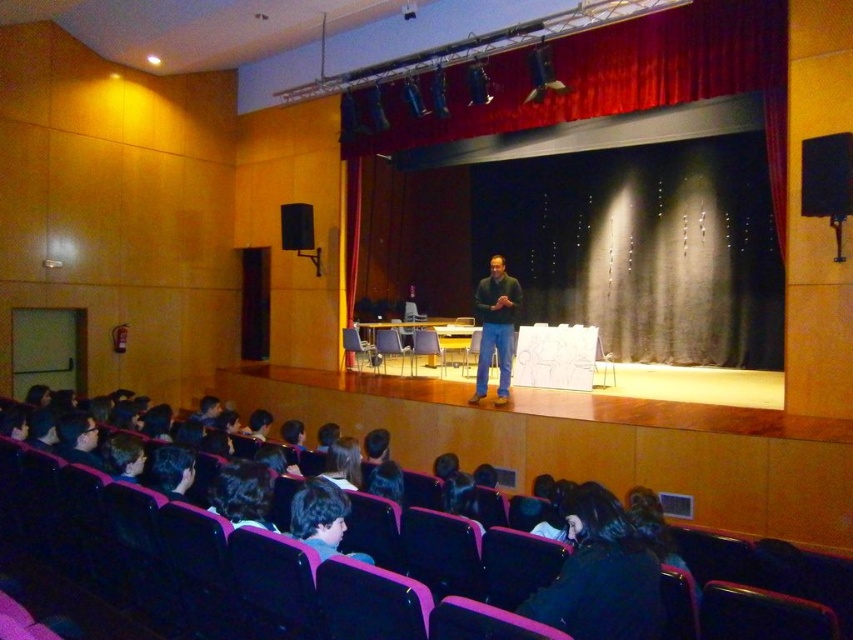
Is red velvet curtain at upper center thinner than black fabric at lower center?

Incorrect, red velvet curtain at upper center's width is not less than black fabric at lower center's.

Is red velvet curtain at upper center to the right of black fabric at lower center from the viewer's perspective?

Yes, red velvet curtain at upper center is to the right of black fabric at lower center.

Does point (465, 97) come in front of point (631, 556)?

That is False.

You are a GUI agent. You are given a task and a screenshot of the screen. Output one action in this format:
    pyautogui.click(x=<x>, y=<y>)
    Task: Click on the red velvet curtain at upper center
    This screenshot has height=640, width=853.
    Given the screenshot: What is the action you would take?
    pyautogui.click(x=556, y=122)

Who is taller, dark green sweater at center or black matte speaker at upper left?

dark green sweater at center

Does dark green sweater at center have a larger size compared to black matte speaker at upper left?

Indeed, dark green sweater at center has a larger size compared to black matte speaker at upper left.

Locate an element on the screen. The image size is (853, 640). dark green sweater at center is located at coordinates (495, 326).

Image resolution: width=853 pixels, height=640 pixels. Find the location of `dark green sweater at center`. dark green sweater at center is located at coordinates (495, 326).

Can you confirm if black fabric at lower center is thinner than black matte speaker at upper left?

Correct, black fabric at lower center's width is less than black matte speaker at upper left's.

Based on the photo, who is more forward, (659, 630) or (281, 220)?

Point (659, 630) is more forward.

The image size is (853, 640). What are the coordinates of `black fabric at lower center` in the screenshot? It's located at (601, 573).